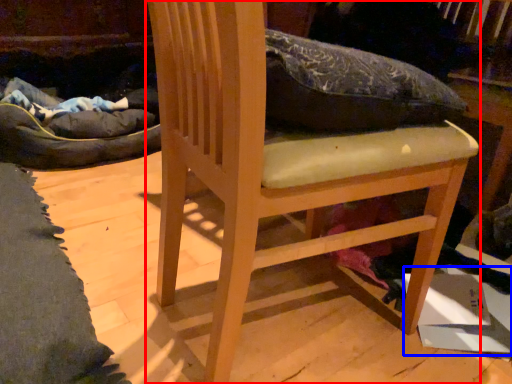
Question: Which object appears closest to the camera in this image, furniture (highlighted by a red box) or cardboard box (highlighted by a blue box)?

Choices:
 (A) furniture
 (B) cardboard box

Answer: (A)